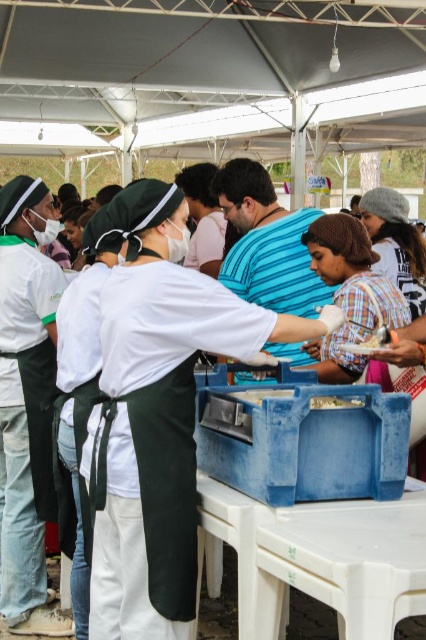
Question: Does white fabric mask at left appear under blue striped shirt at center?

Choices:
 (A) no
 (B) yes

Answer: (B)

Question: Does blue striped shirt at center appear over smooth plastic container at center?

Choices:
 (A) no
 (B) yes

Answer: (B)

Question: Which point is farther from the camera taking this photo?

Choices:
 (A) (284, 209)
 (B) (354, 400)
 (C) (42, 195)

Answer: (A)

Question: Does blue striped shirt at center appear on the left side of smooth plastic container at center?

Choices:
 (A) yes
 (B) no

Answer: (A)

Question: Which object is positioned closest to the blue striped shirt at center?

Choices:
 (A) smooth plastic container at center
 (B) white fabric mask at left

Answer: (B)

Question: Which point is closer to the camera taking this photo?

Choices:
 (A) (36, 300)
 (B) (301, 256)
 (C) (336, 406)

Answer: (C)